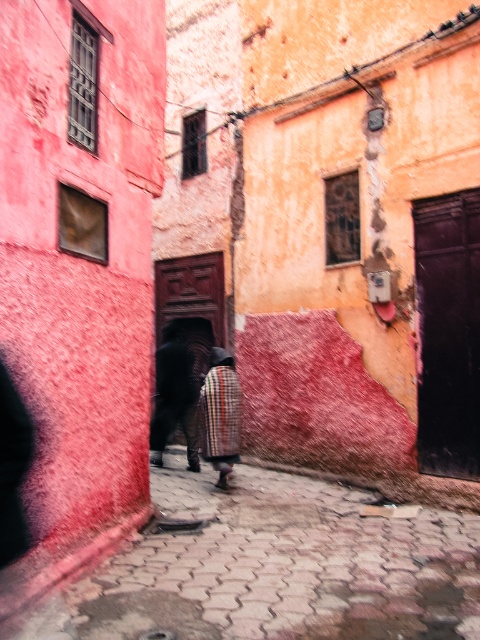
Is point (163, 326) closer to viewer compared to point (204, 378)?

That is False.

Who is more distant from viewer, [191,458] or [217,364]?

Point [191,458]

Is point (195, 406) positioned behind point (200, 400)?

Yes, point (195, 406) is farther from viewer.

Find the location of a particular element. The height and width of the screenshot is (640, 480). dark brown leather pants at center is located at coordinates (173, 396).